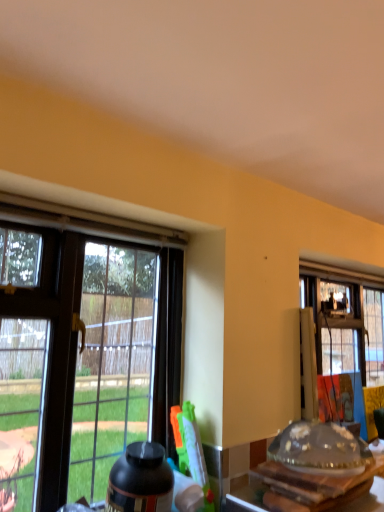
Question: Could you tell me if transparent glass window at left is facing transparent glass table at lower right?

Choices:
 (A) no
 (B) yes

Answer: (A)

Question: Can you confirm if transparent glass window at left is bigger than transparent glass table at lower right?

Choices:
 (A) no
 (B) yes

Answer: (B)

Question: Is transparent glass table at lower right inside transparent glass window at left?

Choices:
 (A) no
 (B) yes

Answer: (A)

Question: Does transparent glass window at left have a smaller size compared to transparent glass table at lower right?

Choices:
 (A) no
 (B) yes

Answer: (A)

Question: From a real-world perspective, is transparent glass window at left on top of transparent glass table at lower right?

Choices:
 (A) no
 (B) yes

Answer: (B)

Question: Is black matte bottle at lower center bigger or smaller than transparent glass window at left?

Choices:
 (A) big
 (B) small

Answer: (B)

Question: In the image, is black matte bottle at lower center positioned in front of or behind transparent glass window at left?

Choices:
 (A) behind
 (B) front

Answer: (A)

Question: Considering the positions of point (168, 465) and point (139, 356), is point (168, 465) closer or farther from the camera than point (139, 356)?

Choices:
 (A) closer
 (B) farther

Answer: (A)

Question: From the image's perspective, relative to transparent glass window at left, is black matte bottle at lower center above or below?

Choices:
 (A) above
 (B) below

Answer: (B)

Question: Considering the positions of transparent glass window at left and black matte bottle at lower center in the image, is transparent glass window at left wider or thinner than black matte bottle at lower center?

Choices:
 (A) wide
 (B) thin

Answer: (A)

Question: Is transparent glass window at left inside the boundaries of black matte bottle at lower center, or outside?

Choices:
 (A) inside
 (B) outside

Answer: (B)

Question: Considering the positions of transparent glass window at left and black matte bottle at lower center in the image, is transparent glass window at left taller or shorter than black matte bottle at lower center?

Choices:
 (A) tall
 (B) short

Answer: (A)

Question: From a real-world perspective, is transparent glass window at left positioned above or below black matte bottle at lower center?

Choices:
 (A) below
 (B) above

Answer: (B)

Question: Considering the relative positions of black matte bottle at lower center and transparent glass table at lower right in the image provided, is black matte bottle at lower center to the left or to the right of transparent glass table at lower right?

Choices:
 (A) right
 (B) left

Answer: (B)

Question: Is black matte bottle at lower center wider or thinner than transparent glass table at lower right?

Choices:
 (A) wide
 (B) thin

Answer: (B)